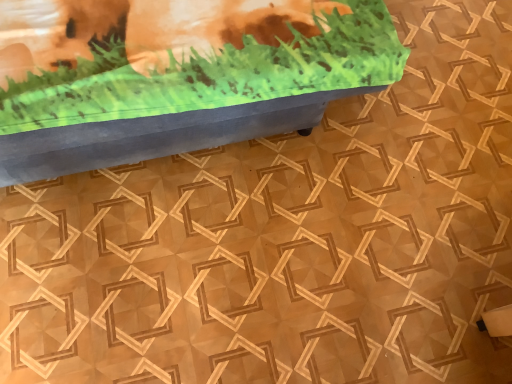
Locate an element on the screen. This screenshot has width=512, height=384. matte blue bench at upper center is located at coordinates (192, 97).

The width and height of the screenshot is (512, 384). Describe the element at coordinates (192, 97) in the screenshot. I see `matte blue bench at upper center` at that location.

Locate an element on the screen. This screenshot has height=384, width=512. matte blue bench at upper center is located at coordinates (192, 97).